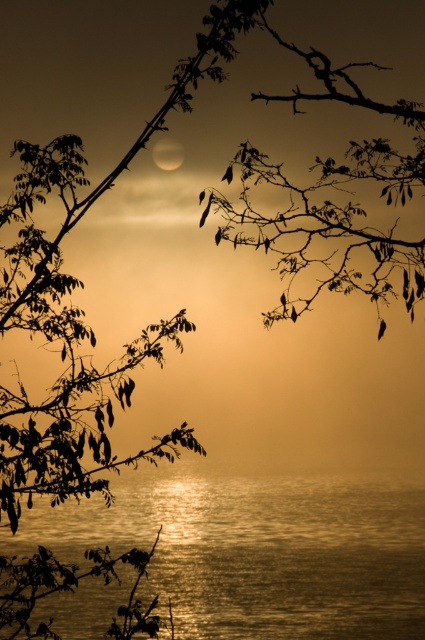
How much distance is there between glistening water at center and smooth white moon at upper center?

They are 4.55 meters apart.

I want to click on glistening water at center, so click(260, 548).

Identify the location of glistening water at center. (260, 548).